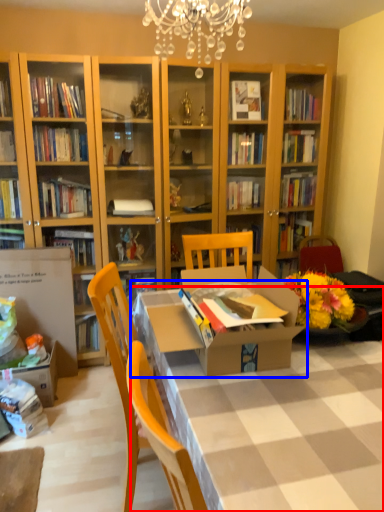
Question: Which point is closer to the camera, desk (highlighted by a red box) or table (highlighted by a blue box)?

Choices:
 (A) desk
 (B) table

Answer: (A)